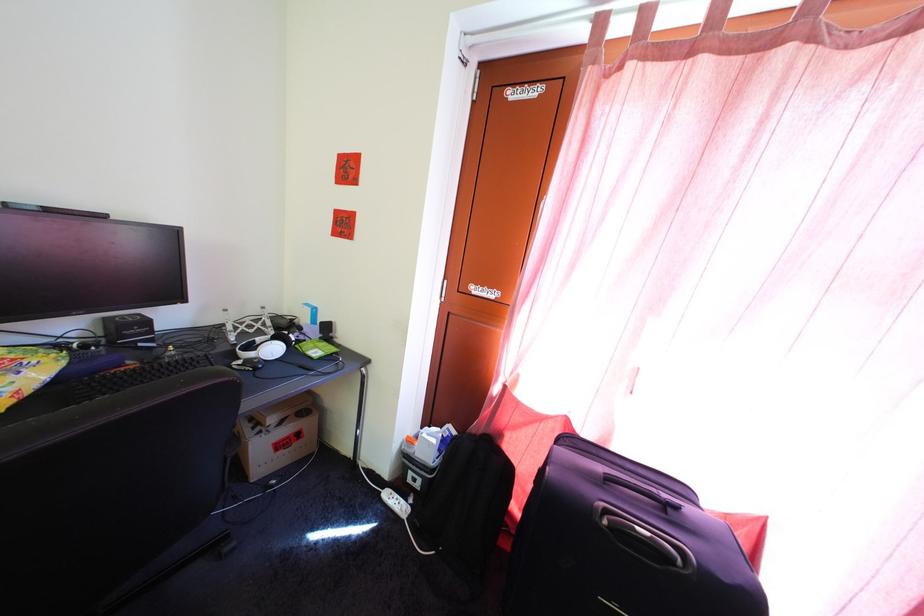
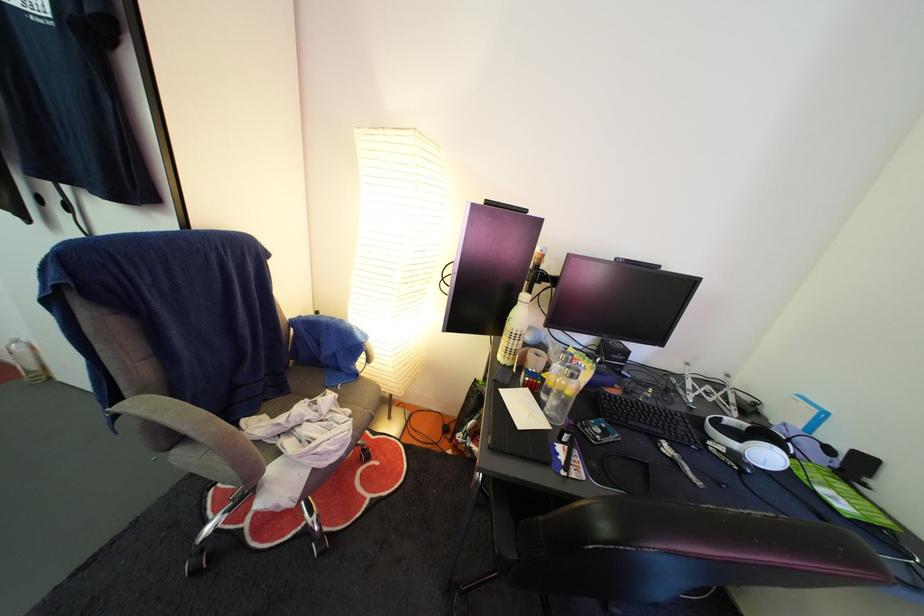
The point at (x=282, y=359) is marked in the first image. Where is the corresponding point in the second image?

(774, 464)